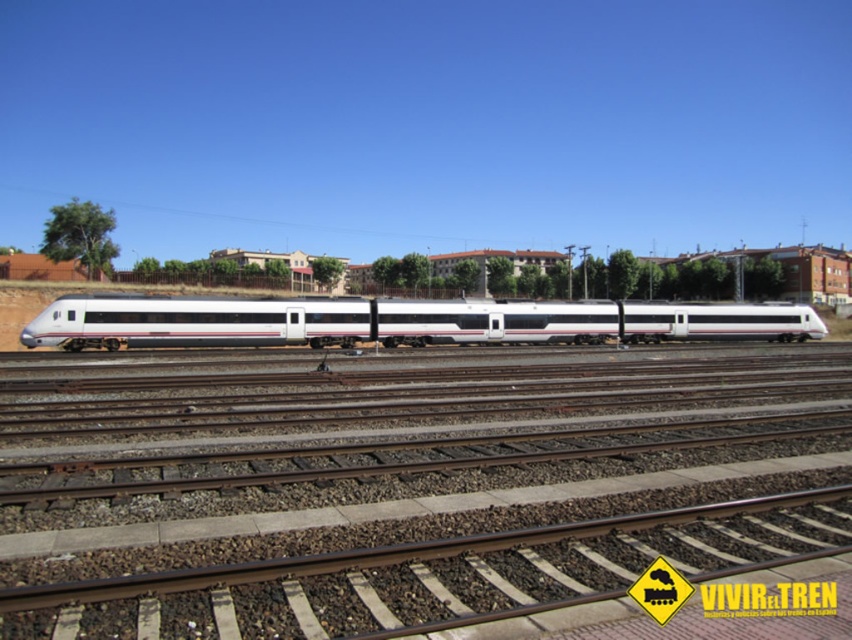
You are a railway inspector checking the tracks. You notice the brown gravel at center and the white glossy train at center. Which object is positioned lower in the image?

The brown gravel at center is located below the white glossy train at center, so it is positioned lower in the image.

You are standing at the point closest to the train in the image. Which of the two points, point (496, 577) or point (559, 328), is closer to you?

Point (496, 577) is in front of point (559, 328), so it is closer to you.

You are a railway engineer assessing the train track layout. You observe the brown gravel at center and the white glossy train at center. Which object is closer to the ground level?

The brown gravel at center is closer to the ground level since it is shorter than the white glossy train at center.